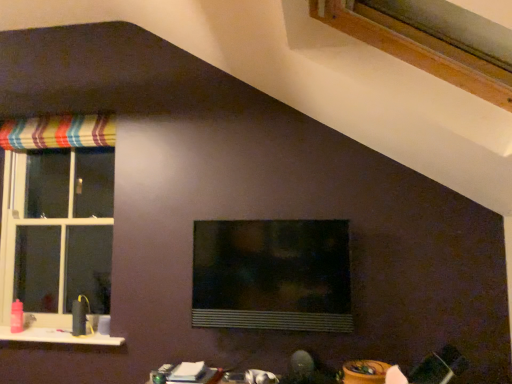
Question: From the image's perspective, is transparent glass window at center, placed as the second window when sorted from back to front, beneath white plastic window at left, arranged as the 1th window when viewed from the left?

Choices:
 (A) no
 (B) yes

Answer: (B)

Question: Can you confirm if transparent glass window at center, placed as the second window when sorted from back to front, is smaller than white plastic window at left, the third window from the front?

Choices:
 (A) no
 (B) yes

Answer: (B)

Question: From the image's perspective, is transparent glass window at center, the 2th window positioned from the right, located above white plastic window at left, the third window from the front?

Choices:
 (A) no
 (B) yes

Answer: (A)

Question: Can you confirm if transparent glass window at center, which is the 2th window in front-to-back order, is taller than white plastic window at left, arranged as the 1th window when viewed from the left?

Choices:
 (A) no
 (B) yes

Answer: (A)

Question: Is transparent glass window at center, placed as the second window when sorted from back to front, directly adjacent to white plastic window at left, arranged as the 1th window when viewed from the left?

Choices:
 (A) no
 (B) yes

Answer: (A)

Question: Considering the positions of transparent glass window at center, the 2th window positioned from the right, and white plastic window at left, marked as the first window in a back-to-front arrangement, in the image, is transparent glass window at center, the 2th window positioned from the right, bigger or smaller than white plastic window at left, marked as the first window in a back-to-front arrangement,?

Choices:
 (A) small
 (B) big

Answer: (A)

Question: From the image's perspective, is transparent glass window at center, arranged as the 2th window when viewed from the left, positioned above or below white plastic window at left, marked as the first window in a back-to-front arrangement?

Choices:
 (A) below
 (B) above

Answer: (A)

Question: Is point (212, 223) closer or farther from the camera than point (61, 233)?

Choices:
 (A) farther
 (B) closer

Answer: (B)

Question: Is transparent glass window at center, placed as the second window when sorted from back to front, in front of or behind white plastic window at left, which ranks as the third window in right-to-left order, in the image?

Choices:
 (A) front
 (B) behind

Answer: (A)

Question: From the image's perspective, relative to striped fabric curtain at upper left, is white glossy table at lower center above or below?

Choices:
 (A) above
 (B) below

Answer: (B)

Question: Considering the positions of white glossy table at lower center and striped fabric curtain at upper left in the image, is white glossy table at lower center bigger or smaller than striped fabric curtain at upper left?

Choices:
 (A) big
 (B) small

Answer: (B)

Question: In terms of width, does white glossy table at lower center look wider or thinner when compared to striped fabric curtain at upper left?

Choices:
 (A) wide
 (B) thin

Answer: (A)

Question: Which is correct: white glossy table at lower center is inside striped fabric curtain at upper left, or outside of it?

Choices:
 (A) inside
 (B) outside

Answer: (B)

Question: From the image's perspective, relative to white glossy window sill at lower left, is white glossy table at lower center above or below?

Choices:
 (A) below
 (B) above

Answer: (A)

Question: Is white glossy table at lower center situated inside white glossy window sill at lower left or outside?

Choices:
 (A) outside
 (B) inside

Answer: (A)